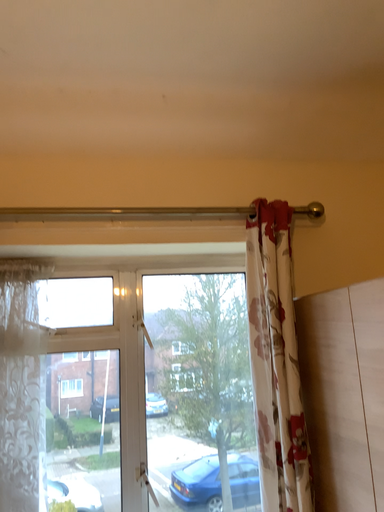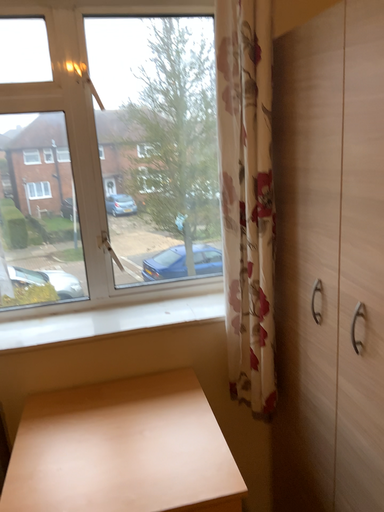
Question: Which way did the camera rotate in the video?

Choices:
 (A) rotated upward
 (B) rotated downward

Answer: (B)